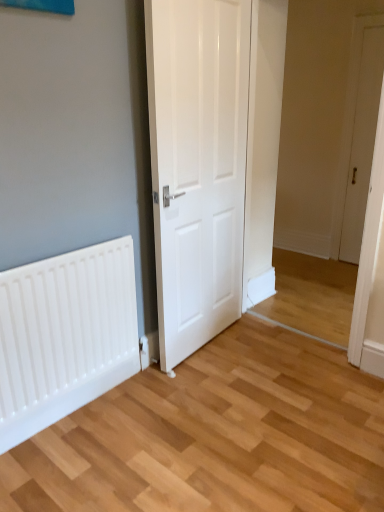
Locate an element on the screen. vacant area that lies between white glossy door at center, the 1th door positioned from the left, and white matte radiator at lower left is located at coordinates (115, 401).